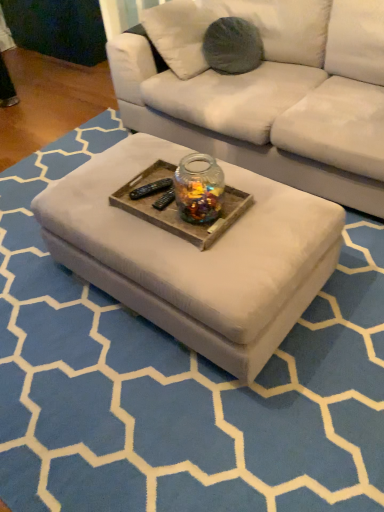
Question: Is white fabric ottoman at center further to camera compared to wooden tray at center?

Choices:
 (A) no
 (B) yes

Answer: (A)

Question: Is white fabric ottoman at center oriented towards wooden tray at center?

Choices:
 (A) no
 (B) yes

Answer: (A)

Question: Can you confirm if white fabric ottoman at center is smaller than wooden tray at center?

Choices:
 (A) no
 (B) yes

Answer: (A)

Question: From a real-world perspective, is white fabric ottoman at center on wooden tray at center?

Choices:
 (A) no
 (B) yes

Answer: (A)

Question: Is white fabric ottoman at center outside of wooden tray at center?

Choices:
 (A) no
 (B) yes

Answer: (B)

Question: Considering the positions of transparent glass jar at center and wooden tray at center in the image, is transparent glass jar at center wider or thinner than wooden tray at center?

Choices:
 (A) wide
 (B) thin

Answer: (B)

Question: From a real-world perspective, is transparent glass jar at center above or below wooden tray at center?

Choices:
 (A) above
 (B) below

Answer: (A)

Question: Considering the positions of transparent glass jar at center and wooden tray at center in the image, is transparent glass jar at center taller or shorter than wooden tray at center?

Choices:
 (A) tall
 (B) short

Answer: (A)

Question: Is transparent glass jar at center in front of or behind wooden tray at center in the image?

Choices:
 (A) front
 (B) behind

Answer: (A)

Question: In terms of size, does wooden tray at center appear bigger or smaller than transparent glass jar at center?

Choices:
 (A) big
 (B) small

Answer: (B)

Question: From a real-world perspective, is wooden tray at center physically located above or below transparent glass jar at center?

Choices:
 (A) above
 (B) below

Answer: (B)

Question: Is wooden tray at center in front of or behind transparent glass jar at center in the image?

Choices:
 (A) front
 (B) behind

Answer: (B)

Question: Considering the positions of point (157, 221) and point (208, 215), is point (157, 221) closer or farther from the camera than point (208, 215)?

Choices:
 (A) farther
 (B) closer

Answer: (A)

Question: Looking at their shapes, would you say transparent glass jar at center is wider or thinner than white fabric ottoman at center?

Choices:
 (A) wide
 (B) thin

Answer: (B)

Question: In terms of height, does transparent glass jar at center look taller or shorter compared to white fabric ottoman at center?

Choices:
 (A) short
 (B) tall

Answer: (B)